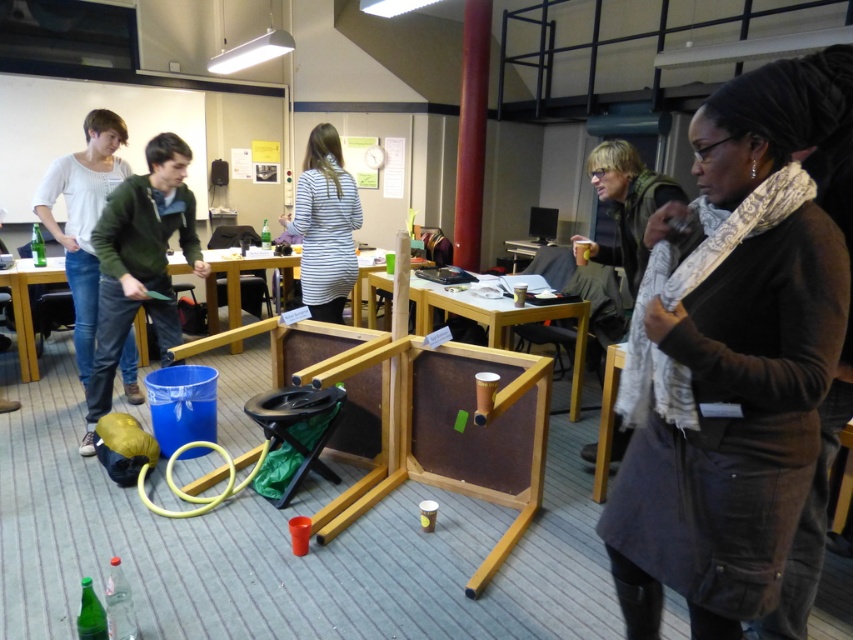
Between green matte jacket at left and striped fabric shirt at center, which one appears on the left side from the viewer's perspective?

From the viewer's perspective, green matte jacket at left appears more on the left side.

Does green matte jacket at left have a larger size compared to striped fabric shirt at center?

Correct, green matte jacket at left is larger in size than striped fabric shirt at center.

Identify the location of green matte jacket at left. (138, 262).

Who is more forward, (x=693, y=502) or (x=123, y=308)?

Point (x=693, y=502) is more forward.

Is dark gray corduroy coat at center taller than green matte jacket at left?

Correct, dark gray corduroy coat at center is much taller as green matte jacket at left.

Which is behind, point (706, 288) or point (151, 298)?

Point (151, 298)

Where is `dark gray corduroy coat at center`? This screenshot has height=640, width=853. dark gray corduroy coat at center is located at coordinates (747, 371).

Does green matte jacket at left appear on the left side of brown wood table at center?

Correct, you'll find green matte jacket at left to the left of brown wood table at center.

Who is more distant from viewer, [160,250] or [490,320]?

Point [490,320]

Does point (171, 205) lie behind point (527, 321)?

No, (171, 205) is in front of (527, 321).

Where is `green matte jacket at left`? The height and width of the screenshot is (640, 853). green matte jacket at left is located at coordinates pyautogui.click(x=138, y=262).